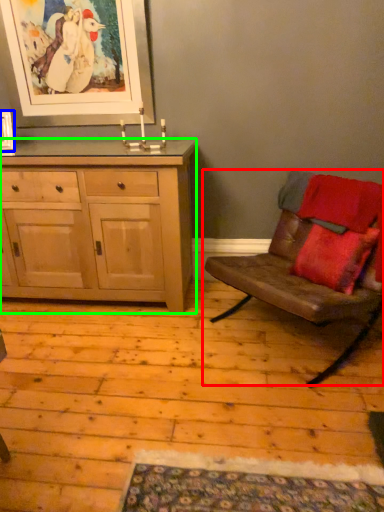
Question: Which object is positioned farthest from chair (highlighted by a red box)? Select from picture frame (highlighted by a blue box) and cabinetry (highlighted by a green box).

Choices:
 (A) picture frame
 (B) cabinetry

Answer: (A)